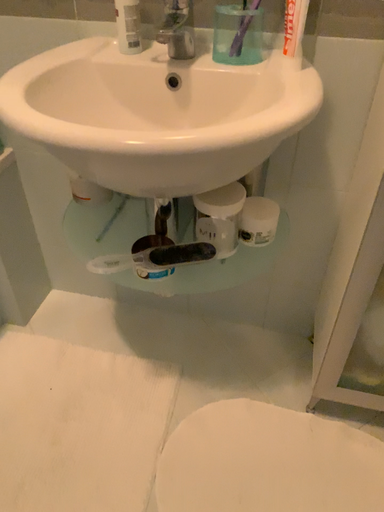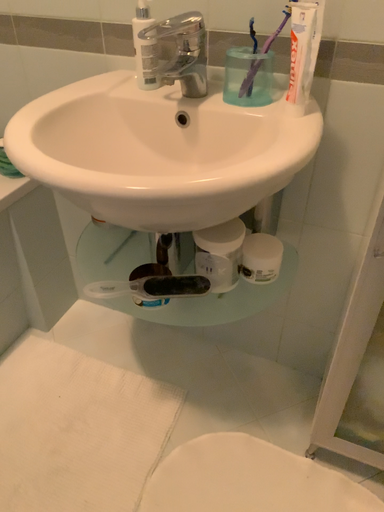
Question: Which way did the camera rotate in the video?

Choices:
 (A) rotated right
 (B) rotated left

Answer: (B)